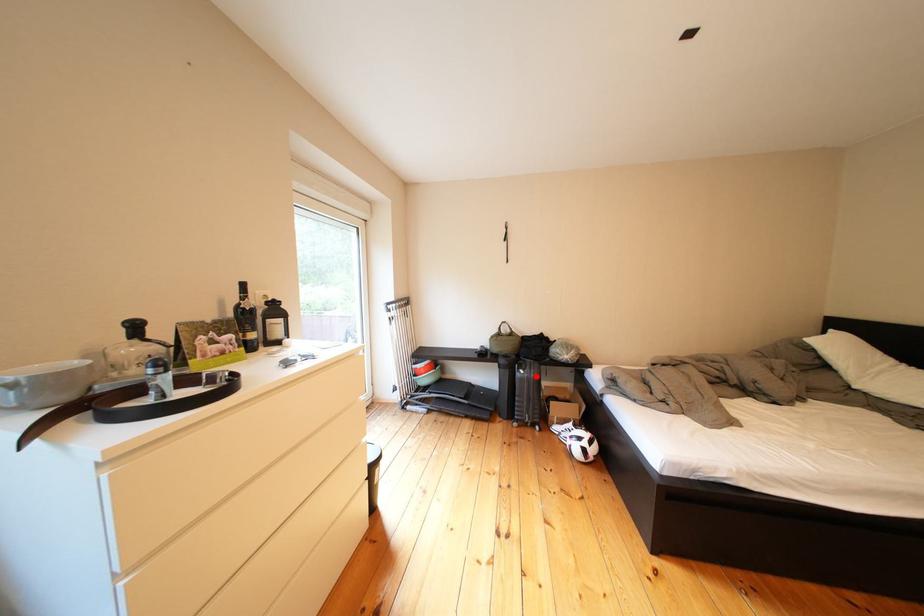
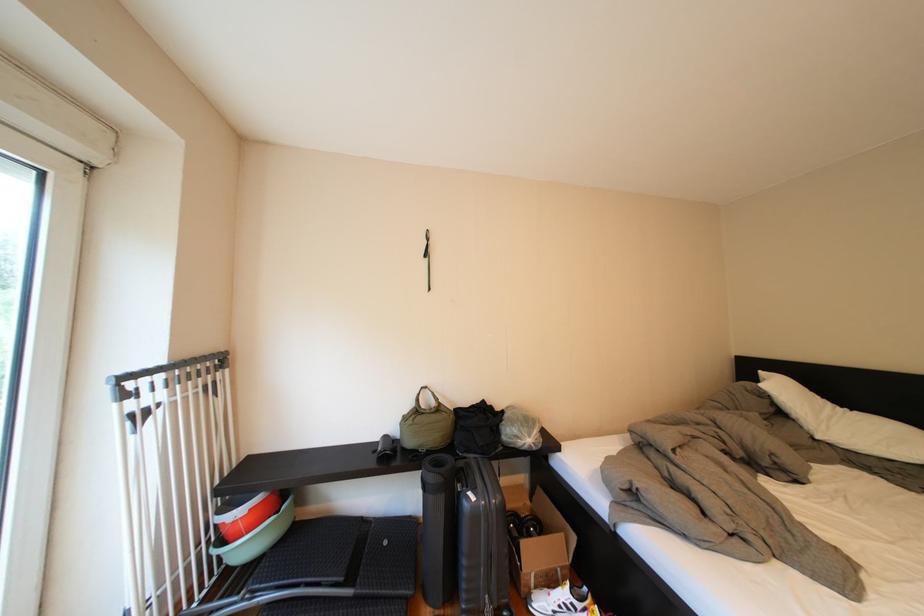
In the second image, find the point that corresponds to the highlighted location in the first image.

(487, 503)